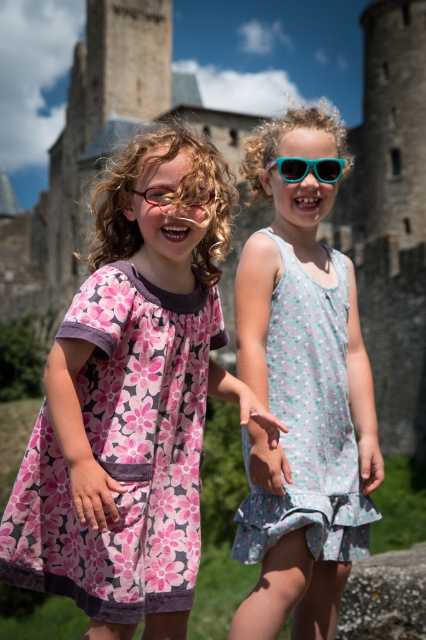
Is floral cotton dress at center thinner than matte red glasses at center?

Incorrect, floral cotton dress at center's width is not less than matte red glasses at center's.

Consider the image. Can you confirm if floral cotton dress at center is bigger than matte red glasses at center?

Yes.

Identify the location of floral cotton dress at center. This screenshot has height=640, width=426. (310, 422).

I want to click on floral cotton dress at center, so click(x=310, y=422).

Does pink floral fabric dress at left appear on the left side of matte red glasses at center?

Indeed, pink floral fabric dress at left is positioned on the left side of matte red glasses at center.

Who is more distant from viewer, (164, 580) or (209, 198)?

The point (209, 198) is more distant.

The image size is (426, 640). In order to click on pink floral fabric dress at left in this screenshot , I will do `click(123, 452)`.

Can you confirm if stone castle at center is taller than matte red glasses at center?

Yes, stone castle at center is taller than matte red glasses at center.

Who is more forward, (68, 202) or (213, 193)?

Point (213, 193) is in front.

Where is `stone castle at center`? This screenshot has height=640, width=426. stone castle at center is located at coordinates tap(389, 218).